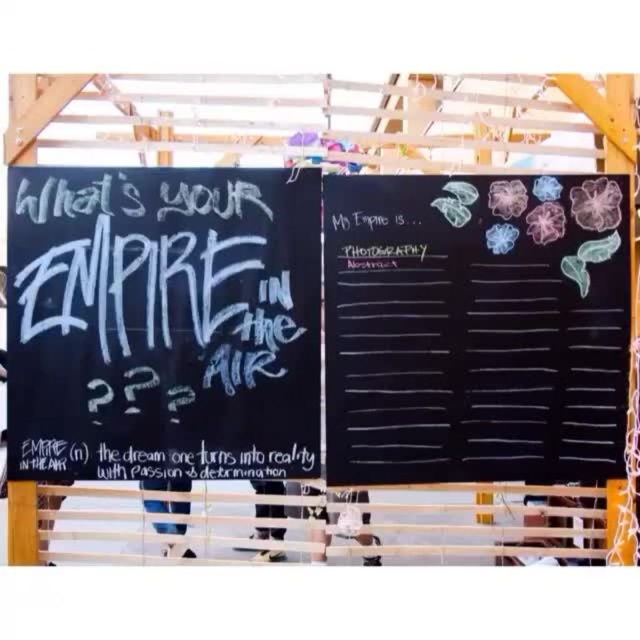
Does white chalkboard at left have a lesser width compared to white chalkboard at center?

No.

Who is positioned more to the right, white chalkboard at left or white chalkboard at center?

white chalkboard at center is more to the right.

Who is more distant from viewer, (284, 444) or (540, 403)?

The point (284, 444) is behind.

This screenshot has height=640, width=640. What are the coordinates of `white chalkboard at left` in the screenshot? It's located at (163, 323).